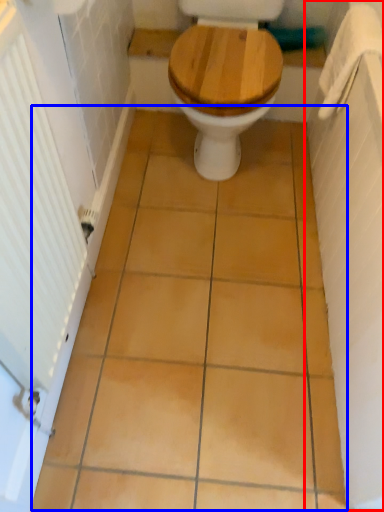
Question: Which object appears closest to the camera in this image, bath (highlighted by a red box) or ceramic tile (highlighted by a blue box)?

Choices:
 (A) bath
 (B) ceramic tile

Answer: (A)